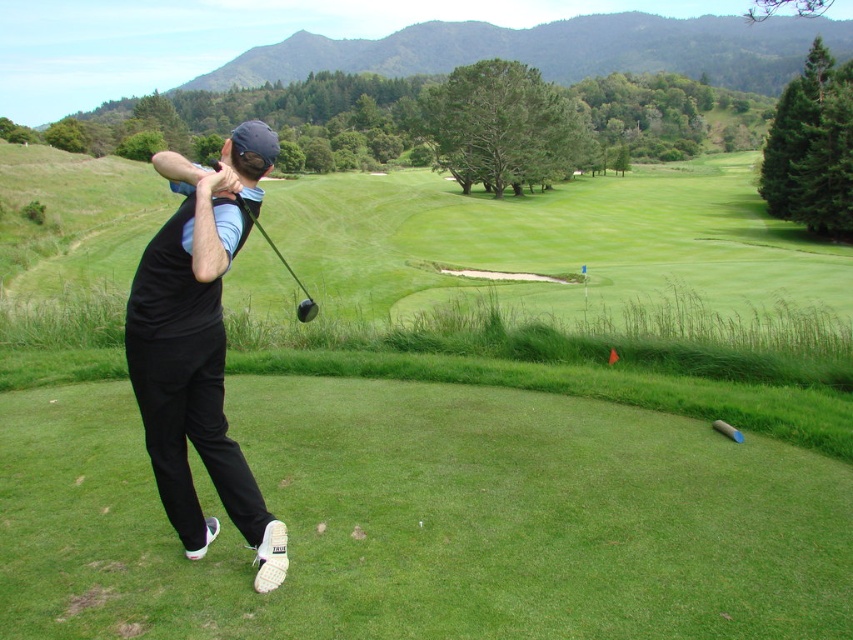
Question: Can you confirm if black matte golf club at center is smaller than shiny black golf club at center?

Choices:
 (A) yes
 (B) no

Answer: (A)

Question: Which object appears closest to the camera in this image?

Choices:
 (A) black matte golf club at center
 (B) shiny black golf club at center

Answer: (A)

Question: Does black matte golf club at center appear on the right side of shiny black golf club at center?

Choices:
 (A) no
 (B) yes

Answer: (B)

Question: Is black matte golf club at center further to the viewer compared to shiny black golf club at center?

Choices:
 (A) no
 (B) yes

Answer: (A)

Question: Which point is closer to the camera?

Choices:
 (A) (300, 289)
 (B) (171, 342)

Answer: (B)

Question: Which object is closer to the camera taking this photo?

Choices:
 (A) shiny black golf club at center
 (B) black matte golf club at center

Answer: (B)